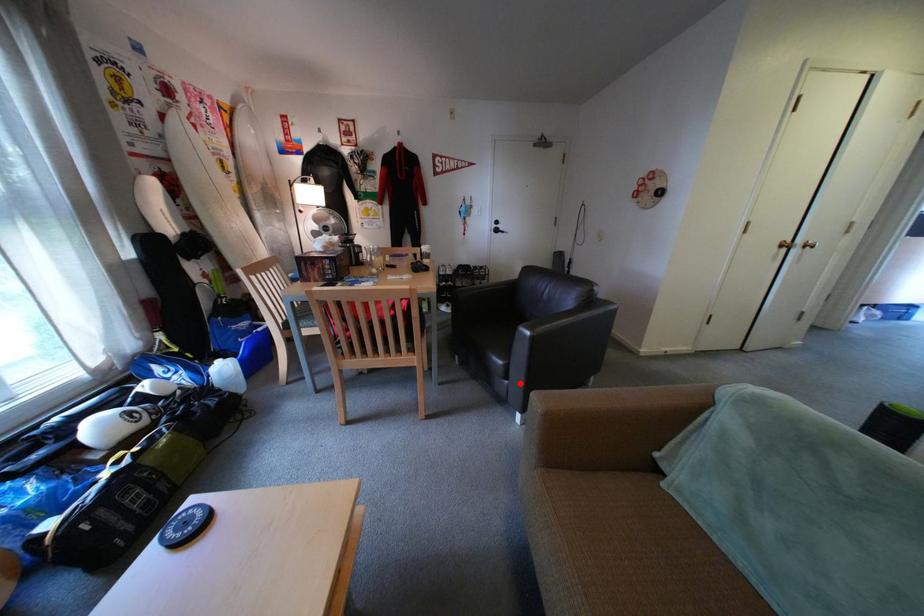
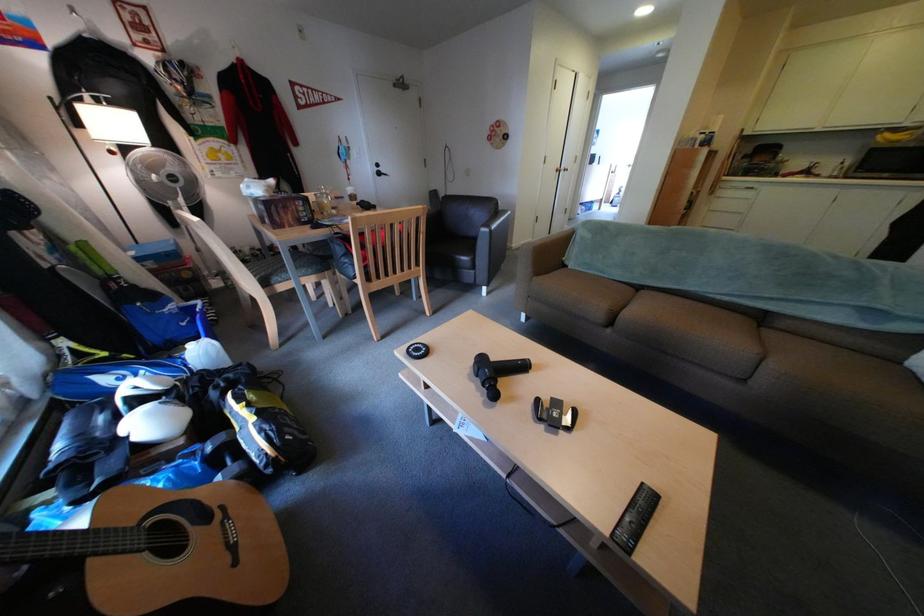
Where in the second image is the point corresponding to the highlighted location from the first image?

(487, 273)